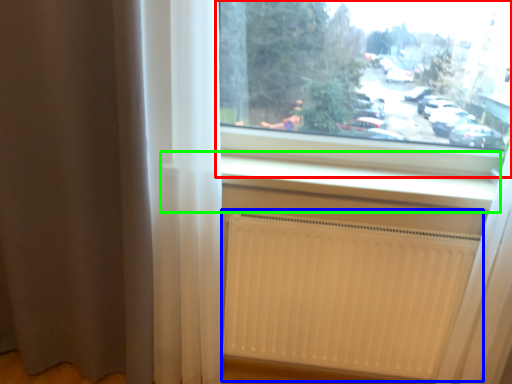
Question: Considering the real-world distances, which object is closest to window (highlighted by a red box)? radiator (highlighted by a blue box) or window sill (highlighted by a green box).

Choices:
 (A) radiator
 (B) window sill

Answer: (B)